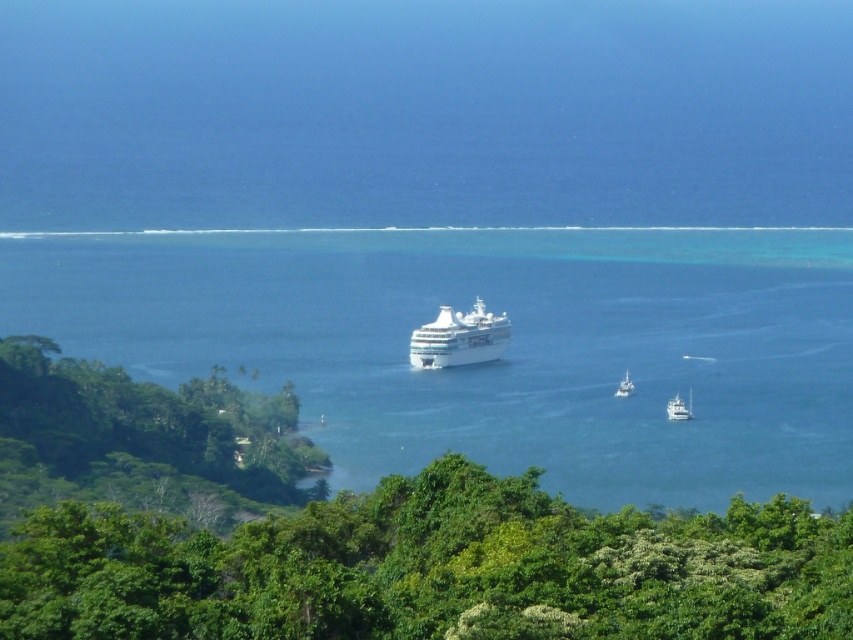
Question: Can you confirm if green leafy trees at center is bigger than white glossy cruise ship at center?

Choices:
 (A) yes
 (B) no

Answer: (A)

Question: Is green leafy trees at center behind white glossy boat at center?

Choices:
 (A) yes
 (B) no

Answer: (B)

Question: Which point is closer to the camera?

Choices:
 (A) (65, 512)
 (B) (689, 406)
 (C) (834, 237)

Answer: (A)

Question: Which object is closer to the camera taking this photo?

Choices:
 (A) white glossy cruise ship at center
 (B) blue water at center
 (C) white glossy boat at lower right
 (D) white glossy boat at center

Answer: (A)

Question: Which point is farther to the camera?

Choices:
 (A) (677, 403)
 (B) (194, 266)
 (C) (137, 584)
 (D) (506, 324)

Answer: (A)

Question: Can you confirm if white glossy cruise ship at center is bigger than white glossy boat at center?

Choices:
 (A) yes
 (B) no

Answer: (A)